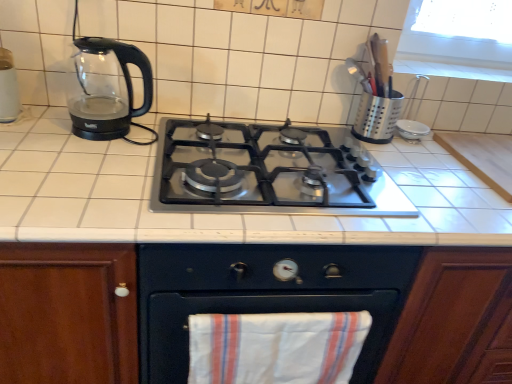
Question: Is wooden cabinet at center with transparent glass kettle at left?

Choices:
 (A) no
 (B) yes

Answer: (A)

Question: Is wooden cabinet at center oriented towards transparent glass kettle at left?

Choices:
 (A) no
 (B) yes

Answer: (A)

Question: Is wooden cabinet at center surrounding transparent glass kettle at left?

Choices:
 (A) no
 (B) yes

Answer: (A)

Question: Is transparent glass kettle at left at the back of wooden cabinet at center?

Choices:
 (A) no
 (B) yes

Answer: (A)

Question: Is wooden cabinet at center not inside transparent glass kettle at left?

Choices:
 (A) yes
 (B) no

Answer: (A)

Question: Is silver metallic utensil holder at upper right inside the boundaries of white tile countertop at center, or outside?

Choices:
 (A) inside
 (B) outside

Answer: (B)

Question: Considering the positions of point (359, 107) and point (337, 129), is point (359, 107) closer or farther from the camera than point (337, 129)?

Choices:
 (A) farther
 (B) closer

Answer: (B)

Question: From their relative heights in the image, would you say silver metallic utensil holder at upper right is taller or shorter than white tile countertop at center?

Choices:
 (A) short
 (B) tall

Answer: (A)

Question: From a real-world perspective, is silver metallic utensil holder at upper right physically located above or below white tile countertop at center?

Choices:
 (A) below
 (B) above

Answer: (B)

Question: In the image, is wooden cabinet at center on the left side or the right side of transparent glass kettle at left?

Choices:
 (A) right
 (B) left

Answer: (A)

Question: From a real-world perspective, is wooden cabinet at center positioned above or below transparent glass kettle at left?

Choices:
 (A) above
 (B) below

Answer: (B)

Question: Considering the positions of wooden cabinet at center and transparent glass kettle at left in the image, is wooden cabinet at center wider or thinner than transparent glass kettle at left?

Choices:
 (A) thin
 (B) wide

Answer: (B)

Question: From the image's perspective, relative to transparent glass kettle at left, is wooden cabinet at center above or below?

Choices:
 (A) below
 (B) above

Answer: (A)

Question: Which is correct: transparent glass kettle at left is inside white tile countertop at center, or outside of it?

Choices:
 (A) inside
 (B) outside

Answer: (B)

Question: Considering the positions of point (82, 39) and point (352, 223), is point (82, 39) closer or farther from the camera than point (352, 223)?

Choices:
 (A) closer
 (B) farther

Answer: (B)